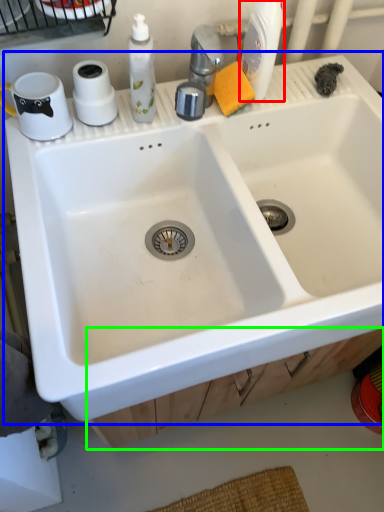
Question: Estimate the real-world distances between objects in this image. Which object is closer to cleaning product (highlighted by a red box), sink (highlighted by a blue box) or drawer (highlighted by a green box)?

Choices:
 (A) sink
 (B) drawer

Answer: (A)